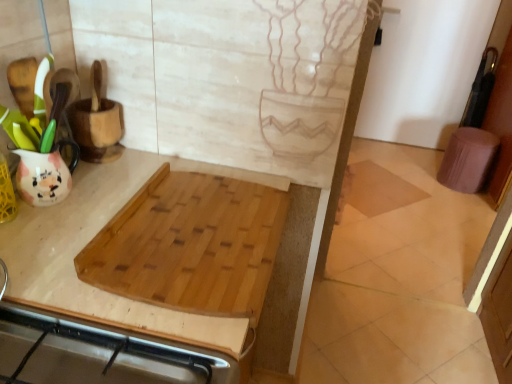
Question: From a real-world perspective, is natural wood cutting board at center positioned under natural wood cutting board at upper left based on gravity?

Choices:
 (A) yes
 (B) no

Answer: (B)

Question: Is the depth of natural wood cutting board at center less than that of natural wood cutting board at upper left?

Choices:
 (A) yes
 (B) no

Answer: (B)

Question: From the image's perspective, is natural wood cutting board at center under natural wood cutting board at upper left?

Choices:
 (A) no
 (B) yes

Answer: (A)

Question: Is natural wood cutting board at center thinner than natural wood cutting board at upper left?

Choices:
 (A) yes
 (B) no

Answer: (A)

Question: From the image's perspective, would you say natural wood cutting board at center is positioned over natural wood cutting board at upper left?

Choices:
 (A) yes
 (B) no

Answer: (A)

Question: Considering the relative sizes of natural wood cutting board at center and natural wood cutting board at upper left in the image provided, is natural wood cutting board at center taller than natural wood cutting board at upper left?

Choices:
 (A) yes
 (B) no

Answer: (B)

Question: Is beige tile at center bigger than natural wood cutting board at center?

Choices:
 (A) yes
 (B) no

Answer: (B)

Question: Does beige tile at center turn towards natural wood cutting board at center?

Choices:
 (A) yes
 (B) no

Answer: (B)

Question: Is beige tile at center in contact with natural wood cutting board at center?

Choices:
 (A) no
 (B) yes

Answer: (A)

Question: From a real-world perspective, is beige tile at center located beneath natural wood cutting board at center?

Choices:
 (A) yes
 (B) no

Answer: (A)

Question: Is beige tile at center outside of natural wood cutting board at center?

Choices:
 (A) no
 (B) yes

Answer: (B)

Question: Is beige tile at center smaller than natural wood cutting board at center?

Choices:
 (A) yes
 (B) no

Answer: (A)

Question: Considering the relative sizes of purple fabric step stool at right and natural wood cutting board at upper left in the image provided, is purple fabric step stool at right thinner than natural wood cutting board at upper left?

Choices:
 (A) no
 (B) yes

Answer: (B)